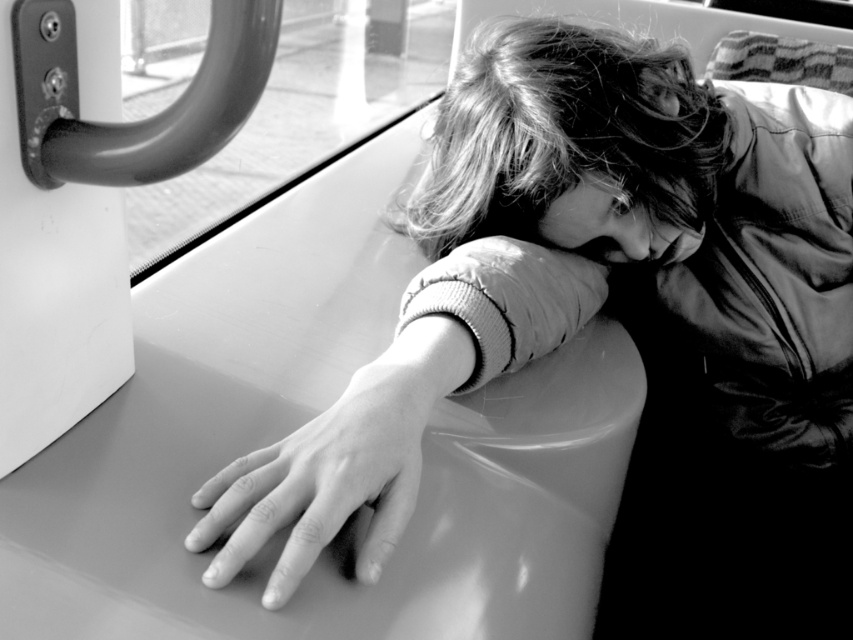
Question: Does transparent glass window at upper left have a smaller size compared to smooth skin hand at lower center?

Choices:
 (A) no
 (B) yes

Answer: (A)

Question: Among these objects, which one is nearest to the camera?

Choices:
 (A) smooth leather arm at center
 (B) transparent glass window at upper left
 (C) smooth skin hand at lower center

Answer: (B)

Question: Where is smooth leather jacket at center located in relation to transparent glass window at upper left in the image?

Choices:
 (A) right
 (B) left

Answer: (A)

Question: Observing the image, what is the correct spatial positioning of smooth leather arm at center in reference to smooth skin hand at lower center?

Choices:
 (A) left
 (B) right

Answer: (B)

Question: Which point is closer to the camera taking this photo?

Choices:
 (A) (582, 97)
 (B) (363, 385)
 (C) (387, 22)

Answer: (B)

Question: Which object is farther from the camera taking this photo?

Choices:
 (A) transparent glass window at upper left
 (B) smooth hair at center

Answer: (B)